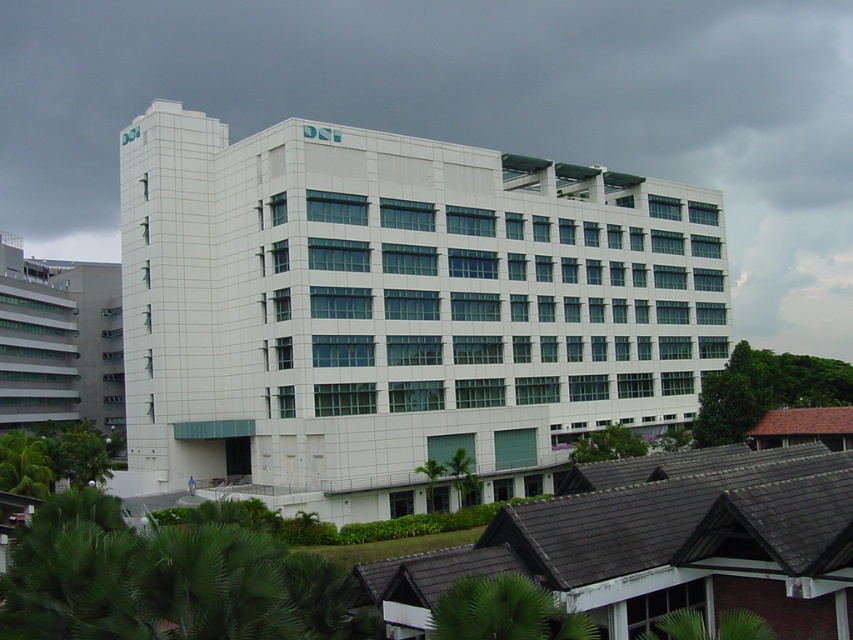
Is point (328, 362) positioned behind point (91, 278)?

No, it is not.

Who is more forward, (419,474) or (9,241)?

Point (419,474)

Image resolution: width=853 pixels, height=640 pixels. Identify the location of white tile building at center. (397, 310).